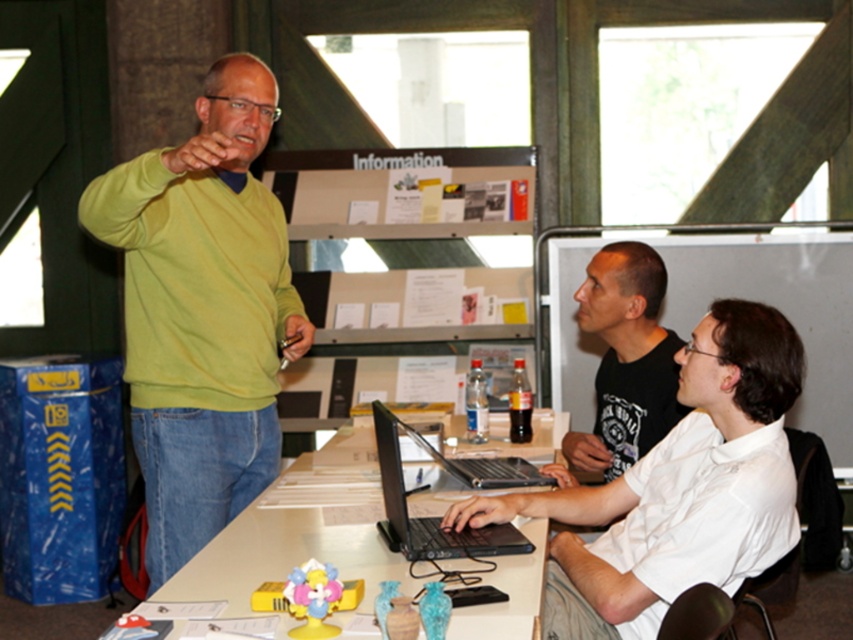
Question: Which point is farther from the camera taking this photo?

Choices:
 (A) (466, 461)
 (B) (666, 355)
 (C) (759, 484)

Answer: (A)

Question: In this image, where is white glossy table at center located relative to black matte laptop at center?

Choices:
 (A) right
 (B) left

Answer: (B)

Question: Is white matte shirt at center positioned behind black matte shirt at center?

Choices:
 (A) yes
 (B) no

Answer: (B)

Question: Which point appears closest to the camera in this image?

Choices:
 (A) (453, 467)
 (B) (160, 161)
 (C) (503, 536)
 (D) (622, 356)

Answer: (B)

Question: Which point is closer to the camera taking this photo?

Choices:
 (A) (381, 470)
 (B) (155, 198)
 (C) (431, 448)
 (D) (287, 477)

Answer: (A)

Question: Does green matte sweater at upper left have a larger size compared to black plastic laptop at center?

Choices:
 (A) no
 (B) yes

Answer: (B)